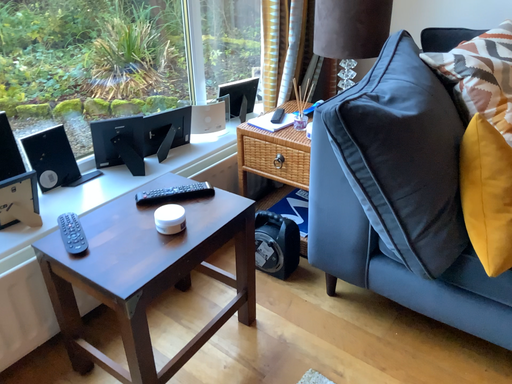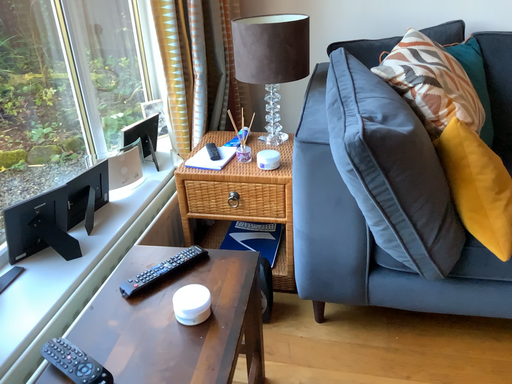
Question: Which way did the camera rotate in the video?

Choices:
 (A) rotated right
 (B) rotated left

Answer: (A)